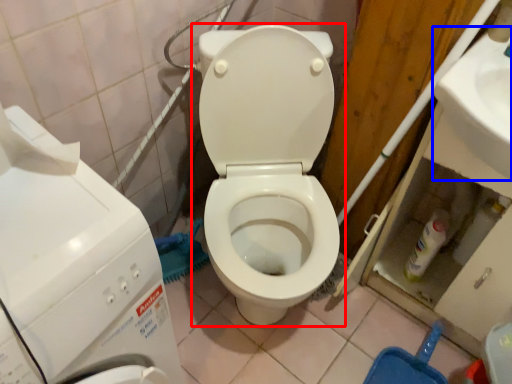
Question: Which object is closer to the camera taking this photo, toilet (highlighted by a red box) or sink (highlighted by a blue box)?

Choices:
 (A) toilet
 (B) sink

Answer: (A)